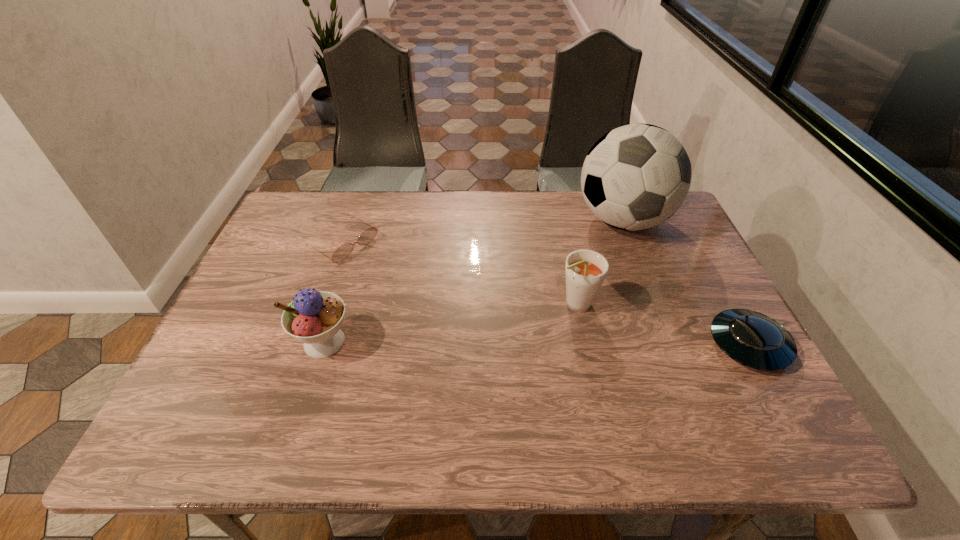
The height and width of the screenshot is (540, 960). Find the location of `icecream`. icecream is located at coordinates (314, 318).

Where is `the fourth tallest object`? Image resolution: width=960 pixels, height=540 pixels. the fourth tallest object is located at coordinates (755, 340).

At what (x,y) coordinates should I click in order to perform the action: click on root beer. Please return your answer as a coordinate pair (x, y). The height and width of the screenshot is (540, 960). Looking at the image, I should click on (585, 272).

Identify the location of the tallest object. (637, 176).

Where is `the shortest object`? The width and height of the screenshot is (960, 540). the shortest object is located at coordinates (341, 253).

I want to click on vacant area situated on the left of the icecream, so (x=219, y=342).

Identify the location of vacant point located on the back of the saucer. (719, 290).

Where is `blank area located 0.090m on the drink side of the root beer`? The height and width of the screenshot is (540, 960). blank area located 0.090m on the drink side of the root beer is located at coordinates (531, 329).

The image size is (960, 540). What are the coordinates of `free spot located on the drink side of the root beer` in the screenshot? It's located at (528, 331).

Image resolution: width=960 pixels, height=540 pixels. Find the location of `free space located on the drink side of the root beer`. free space located on the drink side of the root beer is located at coordinates (517, 336).